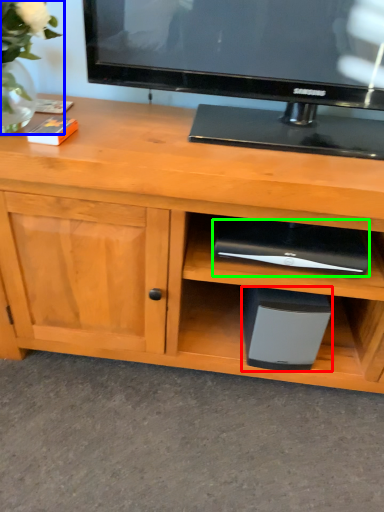
Question: Which is farther away from appliance (highlighted by a red box)? floral arrangement (highlighted by a blue box) or appliance (highlighted by a green box)?

Choices:
 (A) floral arrangement
 (B) appliance

Answer: (A)